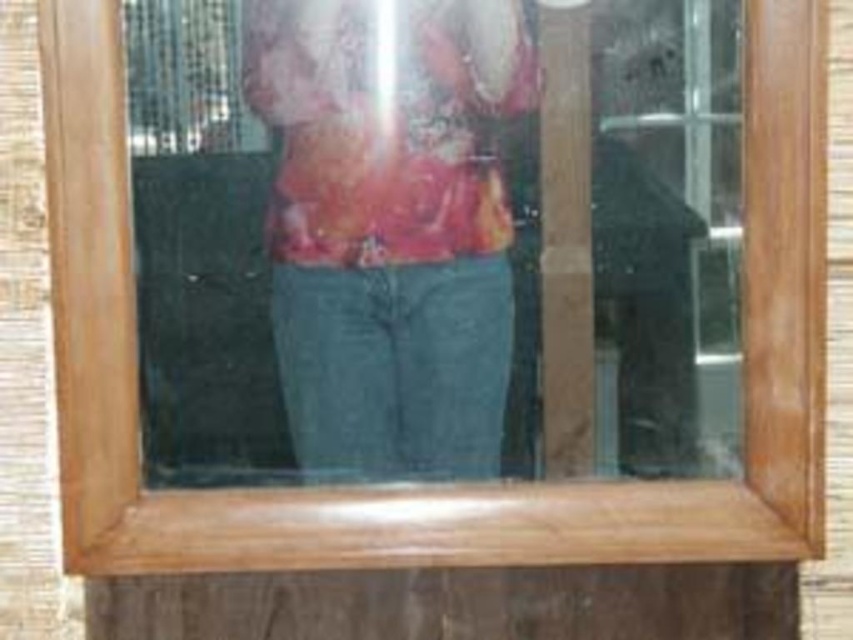
Question: Which of the following is the farthest from the observer?

Choices:
 (A) matte floral shirt at center
 (B) matte glass mirror at center

Answer: (A)

Question: Can you confirm if matte glass mirror at center is positioned to the right of matte floral shirt at center?

Choices:
 (A) no
 (B) yes

Answer: (B)

Question: In this image, where is matte glass mirror at center located relative to matte floral shirt at center?

Choices:
 (A) above
 (B) below

Answer: (B)

Question: Can you confirm if matte glass mirror at center is smaller than matte floral shirt at center?

Choices:
 (A) no
 (B) yes

Answer: (A)

Question: Among these objects, which one is farthest from the camera?

Choices:
 (A) matte floral shirt at center
 (B) matte glass mirror at center

Answer: (A)